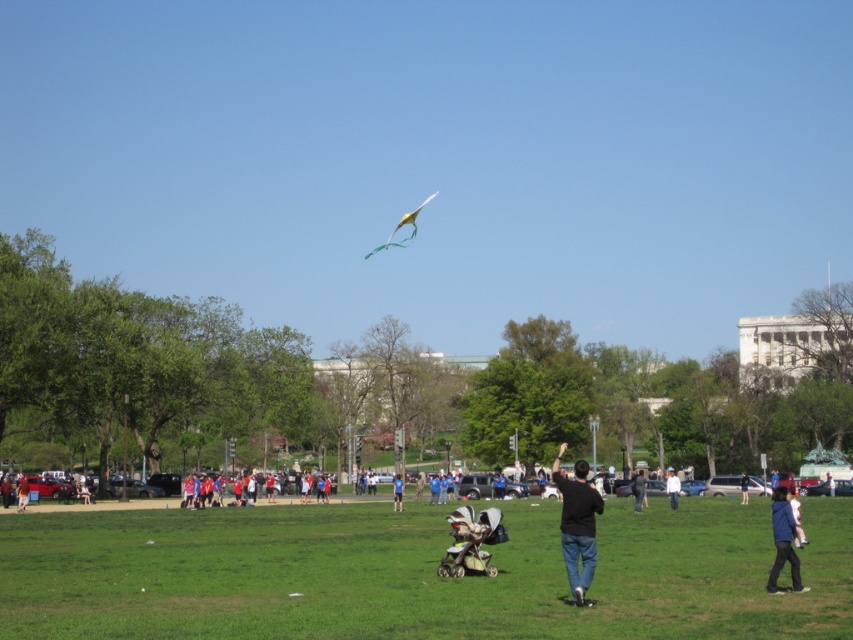
You are standing in the park and see the black matte shirt at center and the blue fabric jacket at lower right. Which clothing item is positioned lower in the image?

The black matte shirt at center is below the blue fabric jacket at lower right, so it is positioned lower in the image.

You are a park visitor who wants to borrow a jacket from either the blue fabric jacket at lower right or the dark blue denim jacket at lower right. Which jacket would you choose if you prefer a lighter one?

The blue fabric jacket at lower right is thinner than the dark blue denim jacket at lower right, so you should choose the blue fabric jacket at lower right as it is lighter.